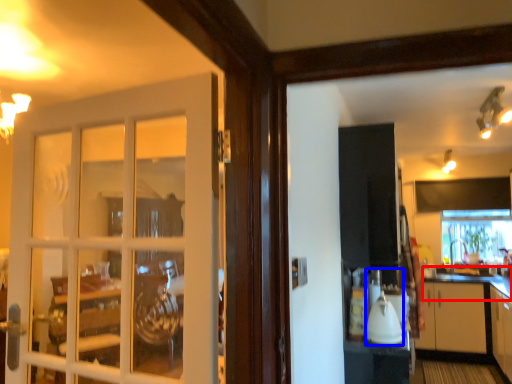
Question: Among these objects, which one is farthest to the camera, counter top (highlighted by a red box) or appliance (highlighted by a blue box)?

Choices:
 (A) counter top
 (B) appliance

Answer: (A)